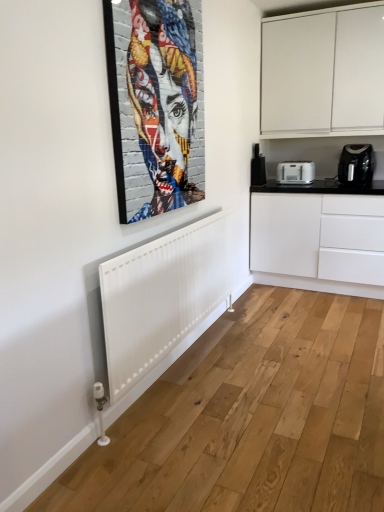
Where is `free location in front of white plastic toaster at center-right, which is the 2th home appliance from right to left`? The height and width of the screenshot is (512, 384). free location in front of white plastic toaster at center-right, which is the 2th home appliance from right to left is located at coordinates (304, 184).